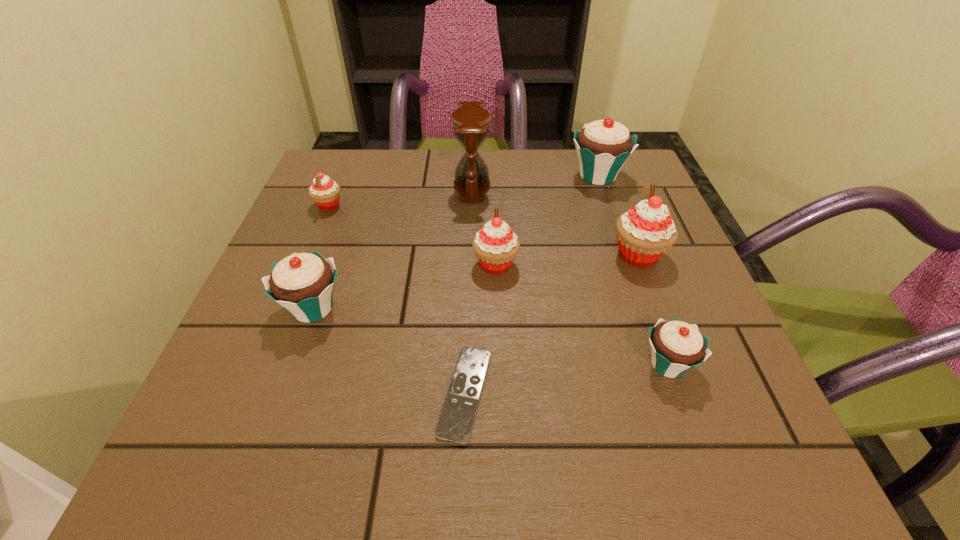
The width and height of the screenshot is (960, 540). Find the location of `free spot that satisfies the following two spatial constraints: 1. on the front side of the nearest teal cupcake; 2. on the right side of the fourth cupcake from right to left`. free spot that satisfies the following two spatial constraints: 1. on the front side of the nearest teal cupcake; 2. on the right side of the fourth cupcake from right to left is located at coordinates (499, 364).

Locate an element on the screen. vacant space that satisfies the following two spatial constraints: 1. on the front side of the fifth nearest cupcake; 2. on the left side of the nearest cupcake is located at coordinates (264, 364).